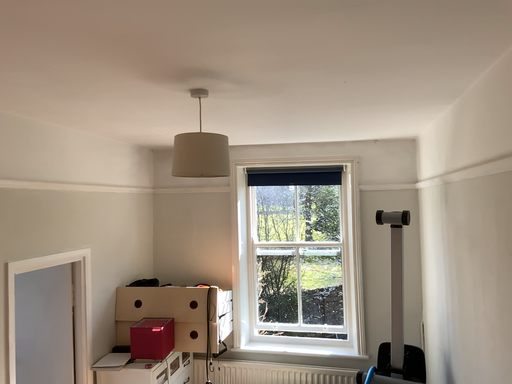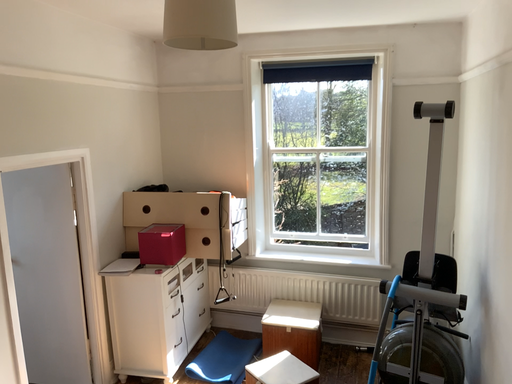
Question: How did the camera likely rotate when shooting the video?

Choices:
 (A) rotated downward
 (B) rotated upward

Answer: (A)